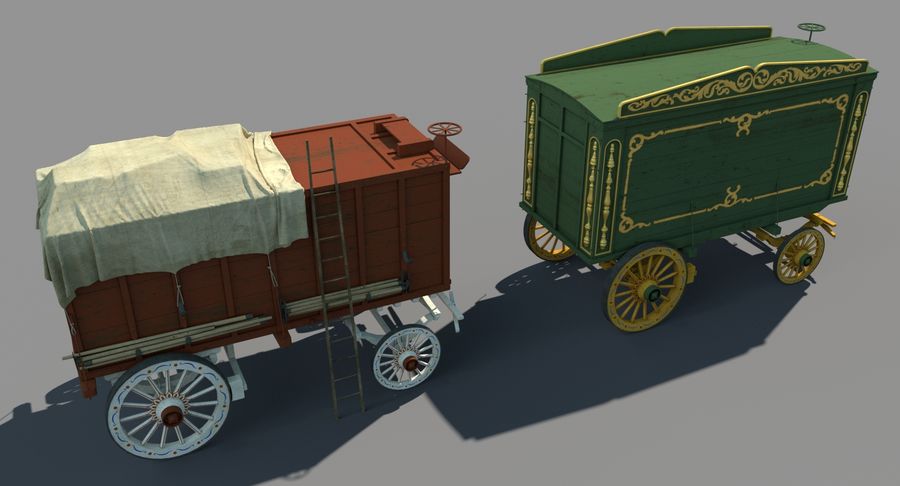
Where is `door`? door is located at coordinates (562, 180).